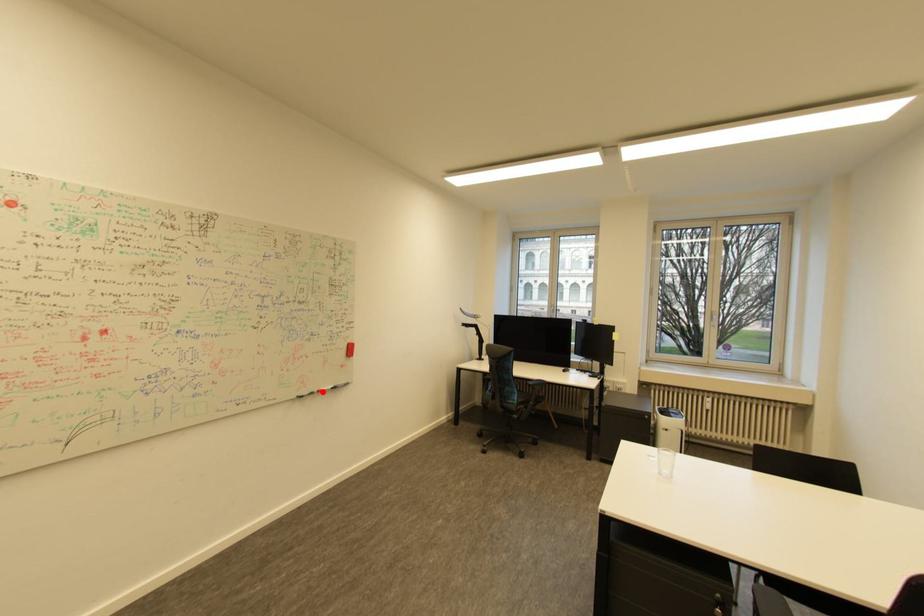
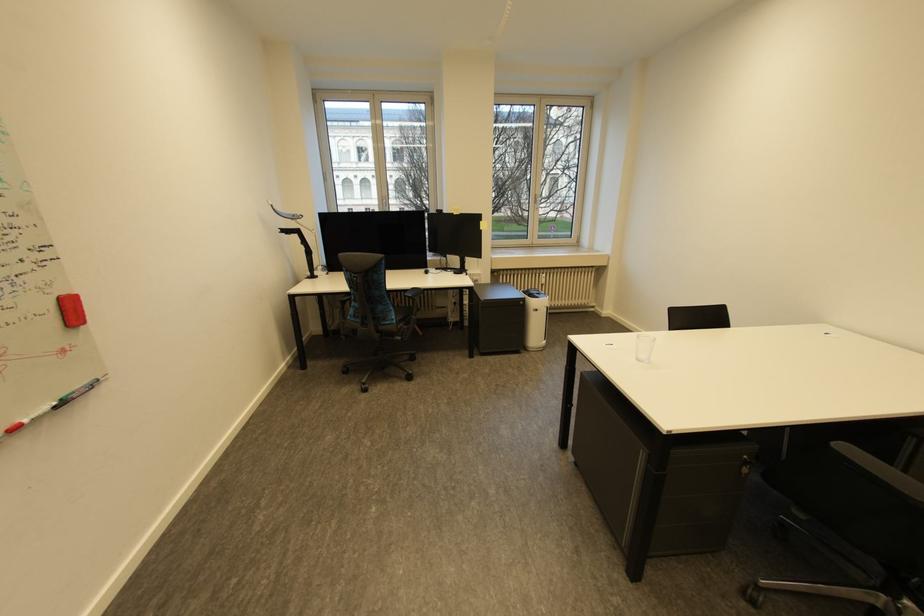
Find the pixel in the second image that matches the highlighted location in the first image.

(6, 436)